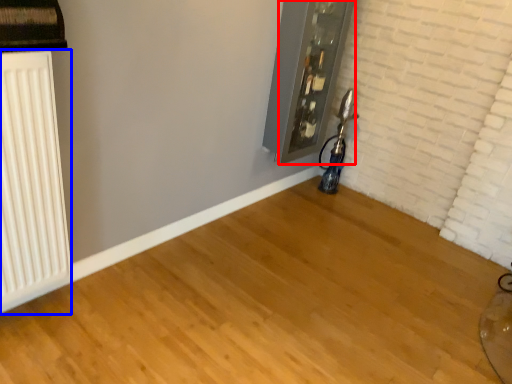
Question: Among these objects, which one is farthest to the camera, window frame (highlighted by a red box) or radiator (highlighted by a blue box)?

Choices:
 (A) window frame
 (B) radiator

Answer: (A)